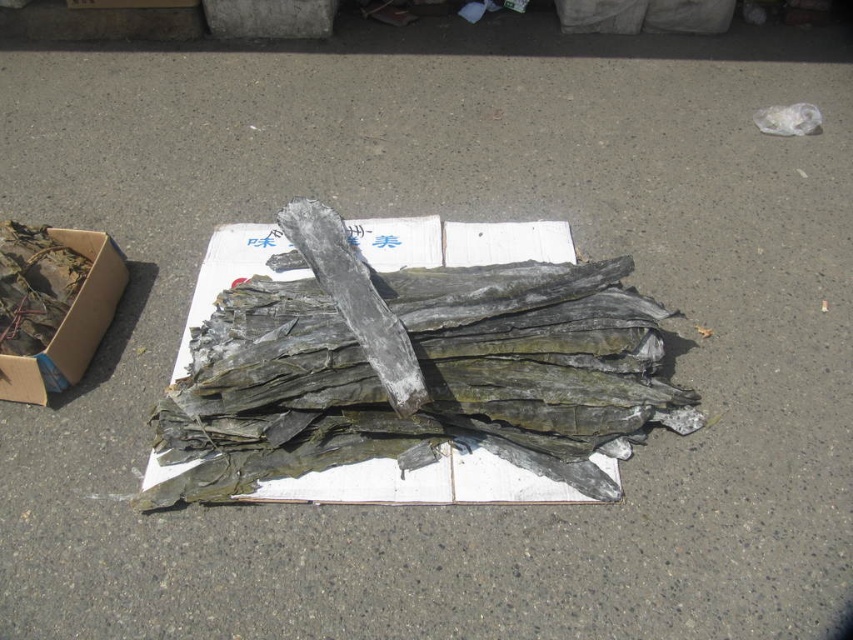
You are standing in front of a pile of dark materials on a white cardboard box. There is a point at coordinates (413, 358). What is the color of the material at that point?

The point at coordinates (413, 358) corresponds to greenish gray wood at center.

You are standing at the edge of the paved surface where the white cardboard box is located. You see two points marked in the image. Which point is closer to you, point (x=344, y=468) or point (x=28, y=397)?

Point (x=344, y=468) is in front of point (x=28, y=397), so it is closer to you.